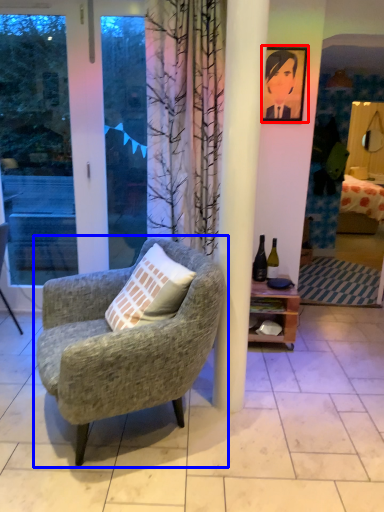
Question: Which point is closer to the camera, picture frame (highlighted by a red box) or chair (highlighted by a blue box)?

Choices:
 (A) picture frame
 (B) chair

Answer: (B)